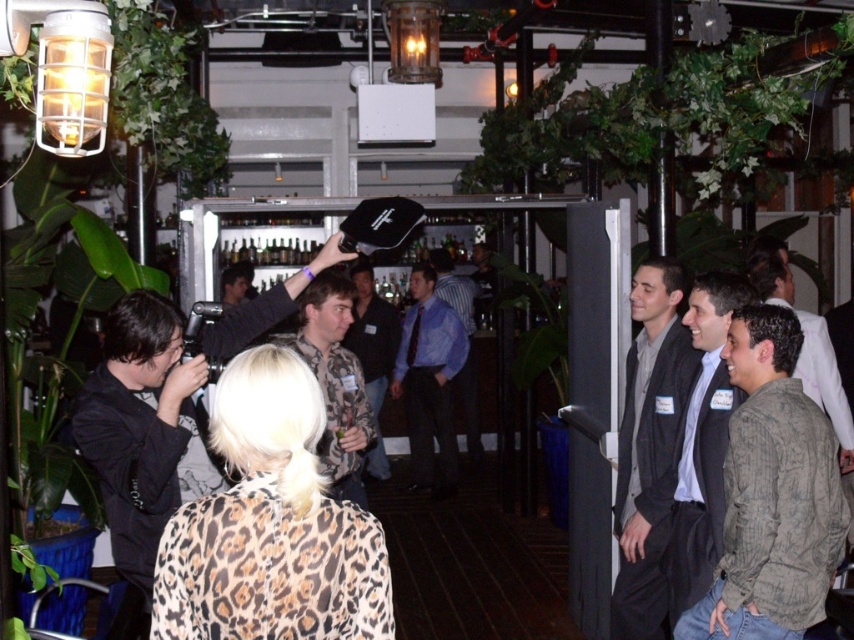
Question: Does blue shirt at center appear over camouflage jacket at center?

Choices:
 (A) yes
 (B) no

Answer: (B)

Question: Does green leafy plant at upper center appear on the right side of camouflage jacket at center?

Choices:
 (A) yes
 (B) no

Answer: (A)

Question: Which object is farther from the camera taking this photo?

Choices:
 (A) blue striped shirt at center
 (B) green leafy plant at upper center
 (C) camouflage shirt at center
 (D) camouflage jacket at center

Answer: (A)

Question: Does green textured shirt at right have a larger size compared to camouflage jacket at center?

Choices:
 (A) no
 (B) yes

Answer: (A)

Question: Which point is farther to the camera?

Choices:
 (A) pyautogui.click(x=624, y=522)
 (B) pyautogui.click(x=706, y=349)
 (C) pyautogui.click(x=424, y=461)
 (D) pyautogui.click(x=453, y=280)

Answer: (D)

Question: Which point is farther to the camera?

Choices:
 (A) dark gray suit at right
 (B) camouflage shirt at center
 (C) camouflage jacket at center

Answer: (C)